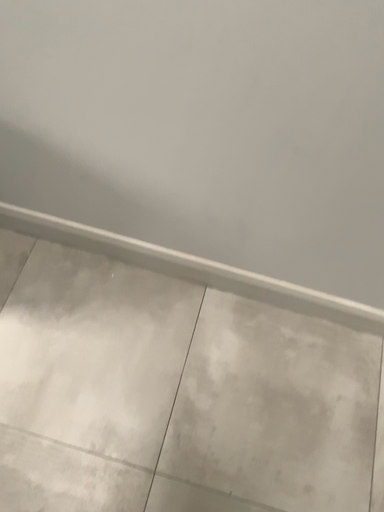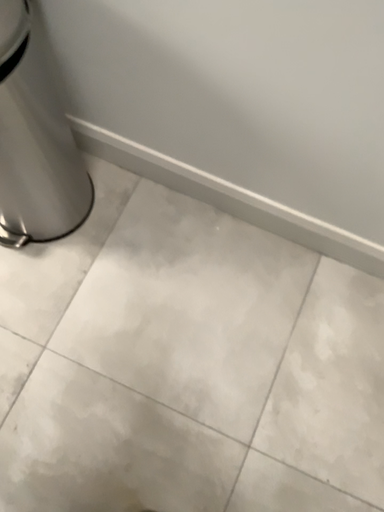
Question: How did the camera likely rotate when shooting the video?

Choices:
 (A) rotated downward
 (B) rotated upward

Answer: (A)